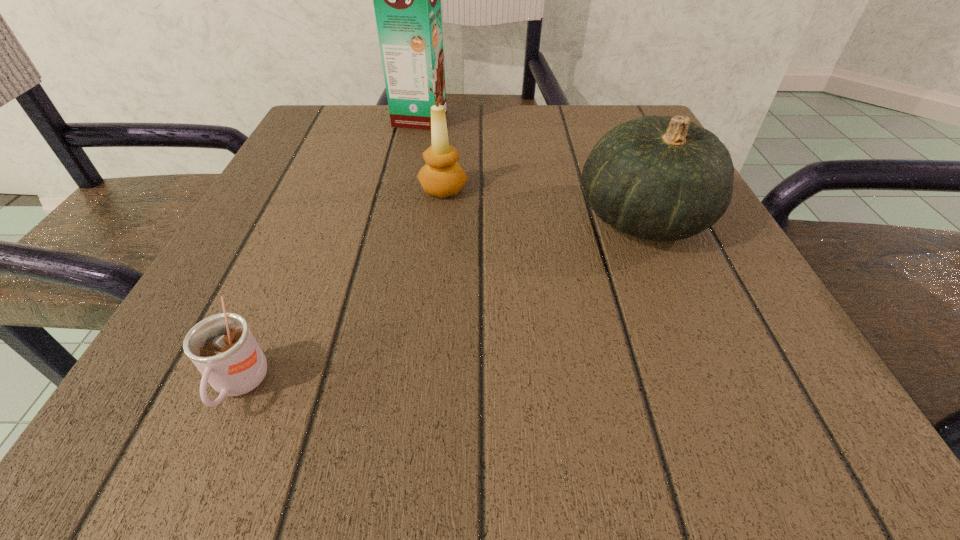
Find the location of a particular element. object at the near edge is located at coordinates (222, 347).

Locate an element on the screen. This screenshot has height=540, width=960. object present at the left edge is located at coordinates (222, 347).

Identify the location of object that is at the right edge. (661, 178).

You are a GUI agent. You are given a task and a screenshot of the screen. Output one action in this format:
    pyautogui.click(x=<x>, y=<y>)
    Task: Click on the object present at the near left corner
    This screenshot has height=540, width=960.
    Given the screenshot: What is the action you would take?
    pyautogui.click(x=222, y=347)

I want to click on free spot at the far edge of the desktop, so click(524, 153).

Where is `blank space at the near edge of the desktop`? Image resolution: width=960 pixels, height=540 pixels. blank space at the near edge of the desktop is located at coordinates (661, 426).

The image size is (960, 540). In order to click on free spot at the left edge of the desktop in this screenshot , I will do `click(332, 184)`.

This screenshot has width=960, height=540. I want to click on vacant space at the right edge of the desktop, so click(x=727, y=306).

In the image, there is a desktop. At what (x,y) coordinates should I click in order to perform the action: click on blank space at the far left corner. Please return your answer as a coordinate pair (x, y). This screenshot has width=960, height=540. Looking at the image, I should click on (370, 127).

You are a GUI agent. You are given a task and a screenshot of the screen. Output one action in this format:
    pyautogui.click(x=<x>, y=<y>)
    Task: Click on the vacant space at the near left corner
    The height and width of the screenshot is (540, 960).
    Given the screenshot: What is the action you would take?
    pyautogui.click(x=200, y=418)